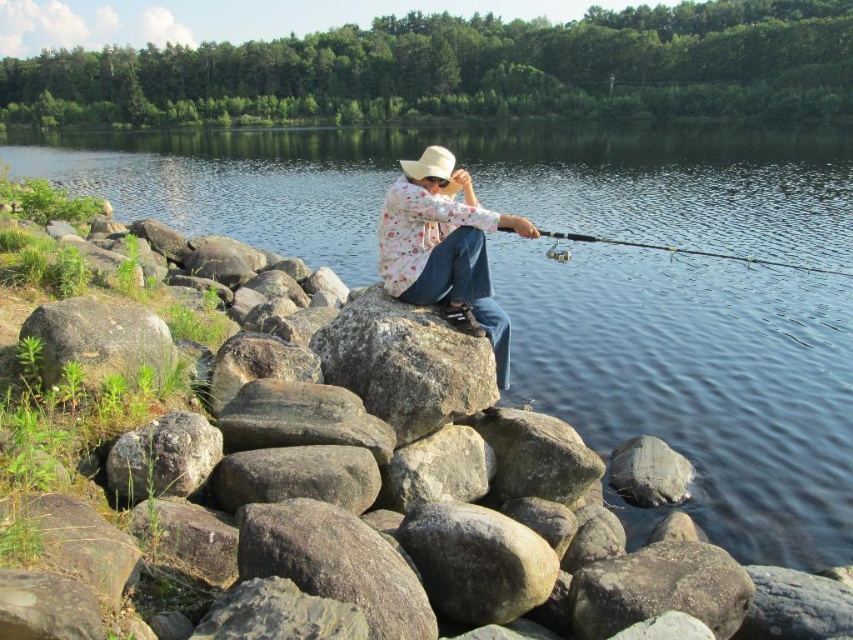
You are standing at the edge of the lake and see the gray rough rock at center and the gray rock at lower left. Which rock is positioned closer to your right side?

The gray rough rock at center is positioned to the right of the gray rock at lower left, so it is closer to your right side.

You are standing at the edge of the lake and want to cast your fishing line to the clear water at center. Based on the coordinates provided, in which direction should you aim your cast relative to your current position?

The clear water at center is located at coordinates point (474, 180), so you should aim your cast towards the center of the lake where the coordinates point to.